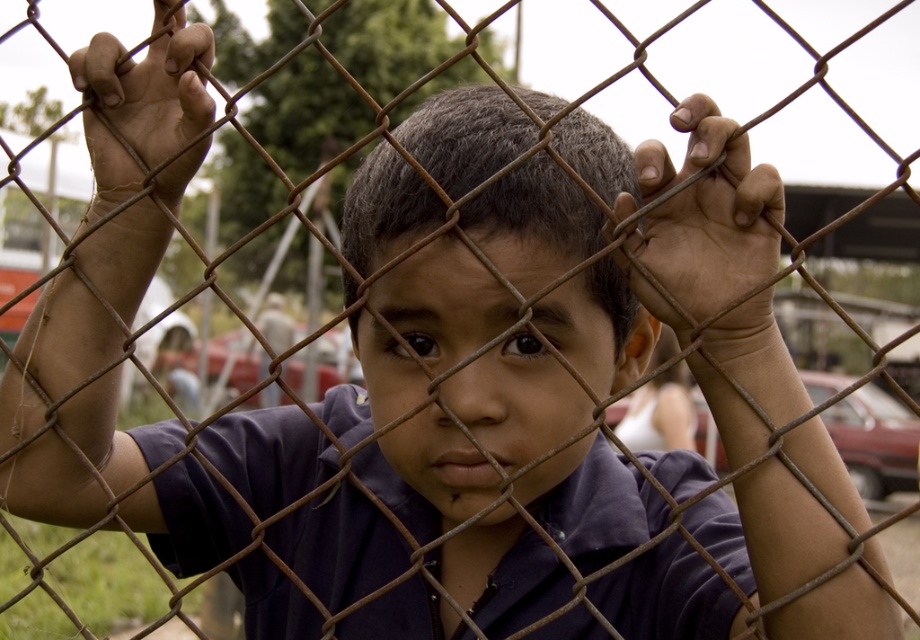
Is matte purple shirt at center taller than brown rough wire at center?

Indeed, matte purple shirt at center has a greater height compared to brown rough wire at center.

Is point (508, 209) closer to viewer compared to point (650, 214)?

No, (508, 209) is behind (650, 214).

Is point (454, 196) more distant than point (660, 276)?

Yes, it is.

At what (x,y) coordinates should I click in order to perform the action: click on matte purple shirt at center. Please return your answer as a coordinate pair (x, y). Looking at the image, I should click on (519, 163).

Who is higher up, matte purple shirt at center or brown rusted wire mesh at left?

Positioned higher is brown rusted wire mesh at left.

Locate an element on the screen. The height and width of the screenshot is (640, 920). matte purple shirt at center is located at coordinates (519, 163).

Which is below, brown rough wire at center or brown rusted wire mesh at left?

brown rough wire at center is below.

Image resolution: width=920 pixels, height=640 pixels. Describe the element at coordinates (707, 212) in the screenshot. I see `brown rough wire at center` at that location.

The height and width of the screenshot is (640, 920). What do you see at coordinates (707, 212) in the screenshot?
I see `brown rough wire at center` at bounding box center [707, 212].

Image resolution: width=920 pixels, height=640 pixels. I want to click on brown rough wire at center, so click(x=707, y=212).